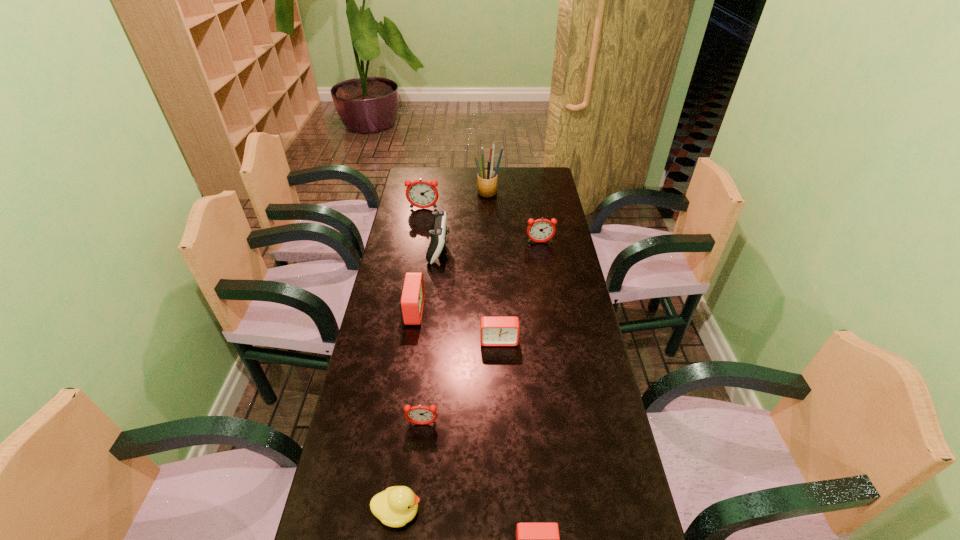
Identify the location of brown pencil box. (486, 179).

Find the location of a particular element. The width and height of the screenshot is (960, 540). the farthest object is located at coordinates (486, 179).

This screenshot has width=960, height=540. In order to click on the tallest alarm clock in this screenshot , I will do `click(420, 193)`.

The width and height of the screenshot is (960, 540). Find the location of `the biggest reddish-pink alarm clock`. the biggest reddish-pink alarm clock is located at coordinates (420, 193).

The height and width of the screenshot is (540, 960). I want to click on control, so click(x=438, y=230).

I want to click on the second nearest reddish-pink alarm clock, so click(541, 230).

Image resolution: width=960 pixels, height=540 pixels. I want to click on the rightmost alarm clock, so coord(541,230).

Locate an element on the screen. the fifth nearest object is located at coordinates (411, 303).

I want to click on the farthest red alarm clock, so click(x=411, y=303).

I want to click on yellow duckling, so click(x=397, y=505).